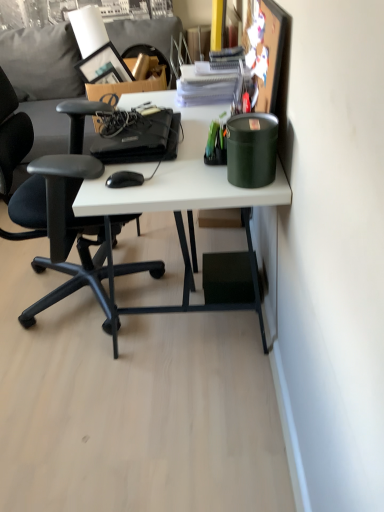
You are a GUI agent. You are given a task and a screenshot of the screen. Output one action in this format:
    pyautogui.click(x=<x>, y=<y>)
    Task: Click on the empty space that is to the right of black plastic mouse at center
    The image size is (384, 512).
    Given the screenshot: What is the action you would take?
    pyautogui.click(x=181, y=176)